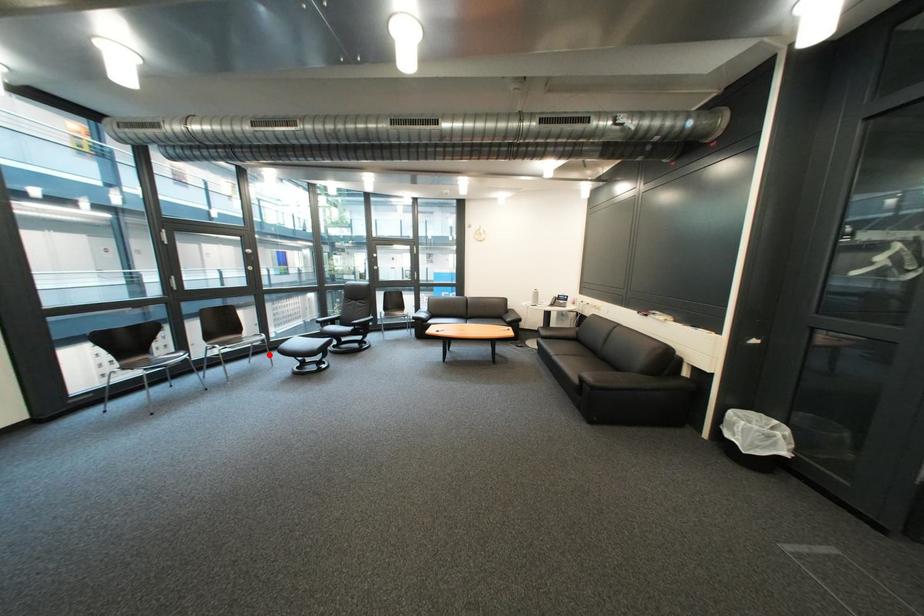
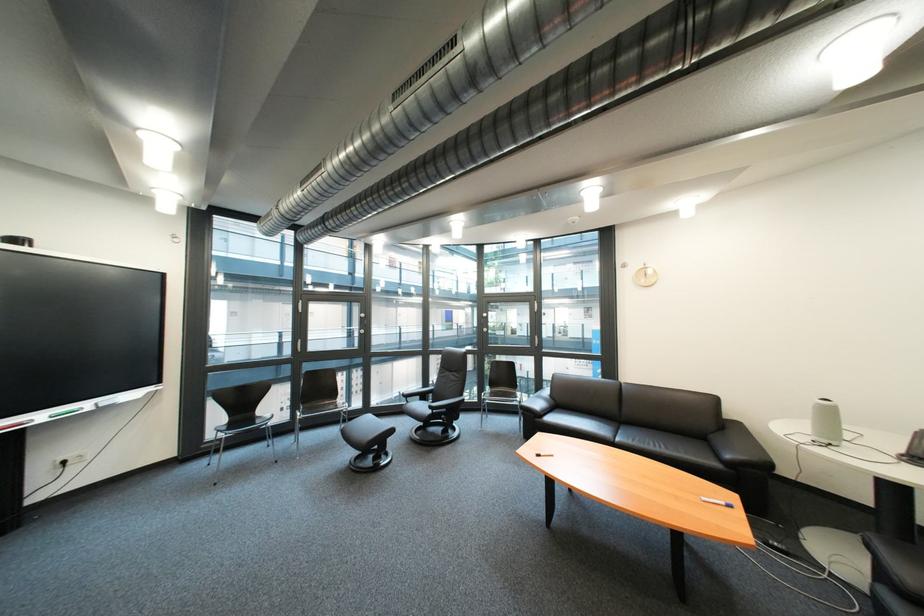
Where in the second image is the point corresponding to the highlighted location from the first image?

(359, 424)